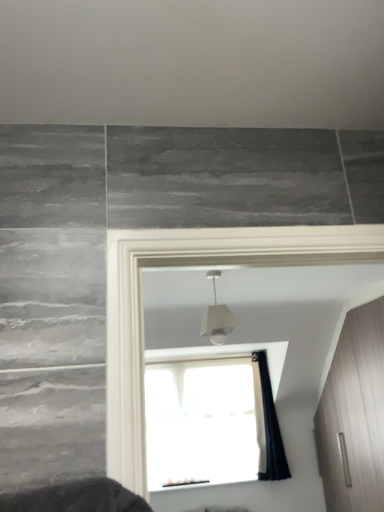
Locate an element on the screen. white matte lampshade at center is located at coordinates (217, 317).

What is the approximate height of white matte lampshade at center?

white matte lampshade at center is 18.00 inches in height.

What do you see at coordinates (217, 317) in the screenshot? This screenshot has width=384, height=512. I see `white matte lampshade at center` at bounding box center [217, 317].

Find the location of a particular element. This screenshot has height=512, width=384. white matte lampshade at center is located at coordinates (217, 317).